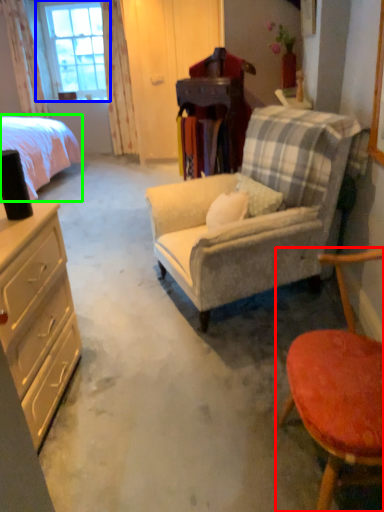
Question: Estimate the real-world distances between objects in this image. Which object is farther from chair (highlighted by a red box), window (highlighted by a blue box) or bed (highlighted by a green box)?

Choices:
 (A) window
 (B) bed

Answer: (A)